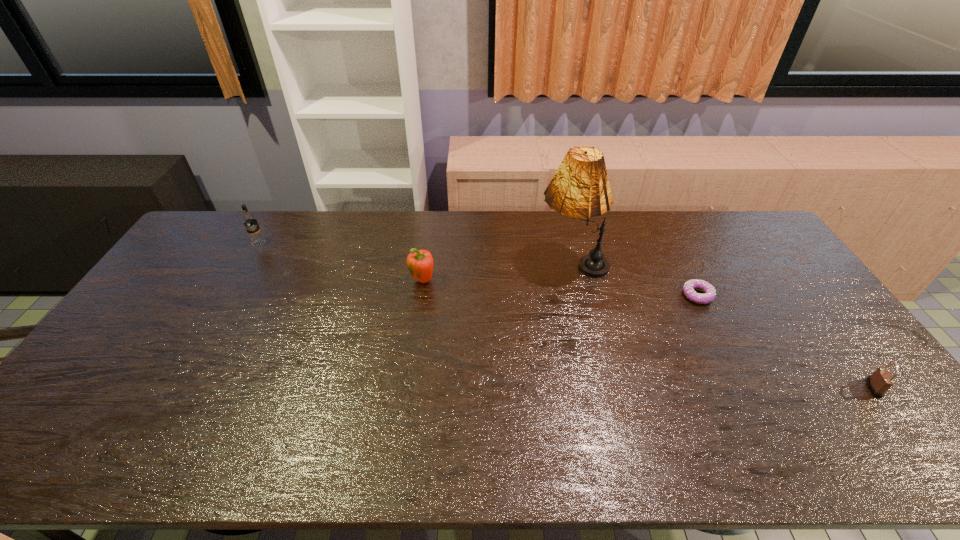
You are a GUI agent. You are given a task and a screenshot of the screen. Output one action in this format:
    pyautogui.click(x=<x>, y=<y>)
    Task: Click on the vacant point located between the nearest object and the second object from right to left
    The height and width of the screenshot is (540, 960).
    Given the screenshot: What is the action you would take?
    pyautogui.click(x=785, y=342)

The width and height of the screenshot is (960, 540). I want to click on free spot between the fourth object from left to right and the fourth object from right to left, so click(x=560, y=288).

You are a GUI agent. You are given a task and a screenshot of the screen. Output one action in this format:
    pyautogui.click(x=<x>, y=<y>)
    Task: Click on the free spot between the tallest object and the third tallest object
    This screenshot has height=540, width=960.
    Given the screenshot: What is the action you would take?
    pos(497,272)

Identify the location of free area in between the tallest object and the third tallest object. (497, 272).

You are a GUI agent. You are given a task and a screenshot of the screen. Output one action in this format:
    pyautogui.click(x=<x>, y=<y>)
    Task: Click on the third closest object to the doughnut
    The height and width of the screenshot is (540, 960).
    Given the screenshot: What is the action you would take?
    pyautogui.click(x=420, y=263)

Locate an element on the screen. The image size is (960, 540). object that is the second closest one to the third tallest object is located at coordinates (249, 220).

At what (x,y) coordinates should I click in order to perform the action: click on free space that satisfies the following two spatial constraints: 1. on the back side of the shortest object; 2. on the front-facing side of the third object from right to left. Please return your answer as a coordinate pair (x, y). Looking at the image, I should click on (681, 263).

Image resolution: width=960 pixels, height=540 pixels. I want to click on vacant area in the image that satisfies the following two spatial constraints: 1. on the front side of the doughnut; 2. on the right side of the padlock, so click(744, 388).

Locate an element on the screen. The image size is (960, 540). blank area in the image that satisfies the following two spatial constraints: 1. on the label of the vodka; 2. on the right side of the doughnut is located at coordinates (228, 295).

Where is `vacant area in the image that satisfies the following two spatial constraints: 1. on the label of the vodka; 2. on the right side of the doughnut`? This screenshot has width=960, height=540. vacant area in the image that satisfies the following two spatial constraints: 1. on the label of the vodka; 2. on the right side of the doughnut is located at coordinates click(x=228, y=295).